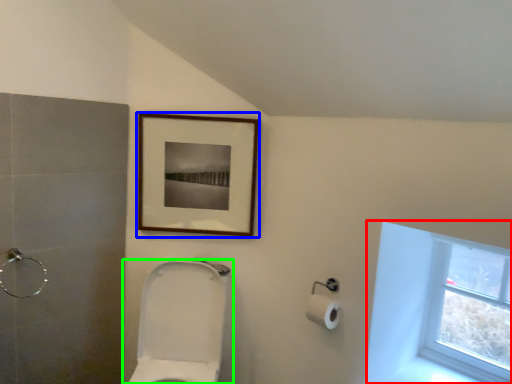
Question: Which object is positioned farthest from window (highlighted by a red box)? Select from picture frame (highlighted by a blue box) and toilet (highlighted by a green box).

Choices:
 (A) picture frame
 (B) toilet

Answer: (B)